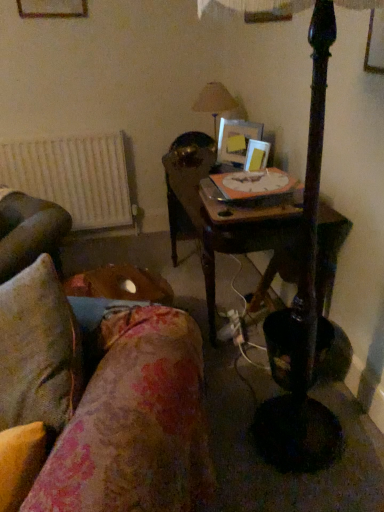
Question: Can you confirm if matte beige lampshade at upper center is smaller than wooden table at center?

Choices:
 (A) yes
 (B) no

Answer: (A)

Question: Is matte beige lampshade at upper center oriented towards wooden table at center?

Choices:
 (A) no
 (B) yes

Answer: (A)

Question: Is wooden table at center completely or partially inside matte beige lampshade at upper center?

Choices:
 (A) yes
 (B) no

Answer: (B)

Question: Is matte beige lampshade at upper center wider than wooden table at center?

Choices:
 (A) yes
 (B) no

Answer: (B)

Question: Can you confirm if matte beige lampshade at upper center is shorter than wooden table at center?

Choices:
 (A) yes
 (B) no

Answer: (A)

Question: Is matte beige lampshade at upper center positioned in front of wooden table at center?

Choices:
 (A) no
 (B) yes

Answer: (A)

Question: Is floral fabric couch at lower left thinner than matte beige lampshade at upper center?

Choices:
 (A) yes
 (B) no

Answer: (B)

Question: Is floral fabric couch at lower left positioned far away from matte beige lampshade at upper center?

Choices:
 (A) no
 (B) yes

Answer: (B)

Question: Is floral fabric couch at lower left further to camera compared to matte beige lampshade at upper center?

Choices:
 (A) no
 (B) yes

Answer: (A)

Question: Can you see floral fabric couch at lower left touching matte beige lampshade at upper center?

Choices:
 (A) yes
 (B) no

Answer: (B)

Question: Is floral fabric couch at lower left at the right side of matte beige lampshade at upper center?

Choices:
 (A) no
 (B) yes

Answer: (A)

Question: Does floral fabric couch at lower left come in front of matte beige lampshade at upper center?

Choices:
 (A) yes
 (B) no

Answer: (A)

Question: Is matte beige lampshade at upper center at the back of white matte radiator at left?

Choices:
 (A) no
 (B) yes

Answer: (A)